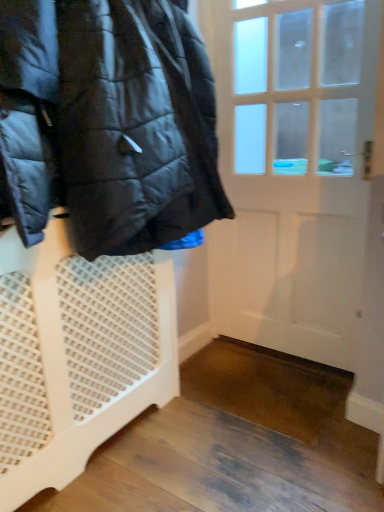
Where is `vacant space underneath glossy black jacket at left (from a real-world perspective)`? Image resolution: width=384 pixels, height=512 pixels. vacant space underneath glossy black jacket at left (from a real-world perspective) is located at coordinates (180, 431).